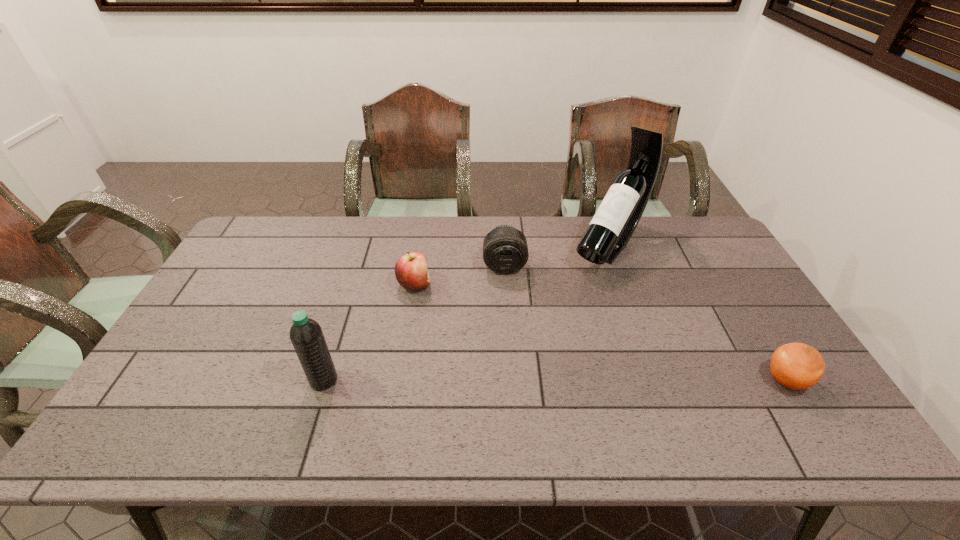
This screenshot has height=540, width=960. I want to click on free space on the desktop that is between the water bottle and the orange and is positioned on the front-facing side of the telephoto lens, so click(511, 380).

I want to click on vacant space on the desktop that is between the second tallest object and the orange and is positioned on the bitten side of the apple, so click(x=618, y=380).

This screenshot has width=960, height=540. What are the coordinates of `vacant space on the desktop that is between the water bottle and the orange and is positioned on the stand of the tallest object` in the screenshot? It's located at (497, 380).